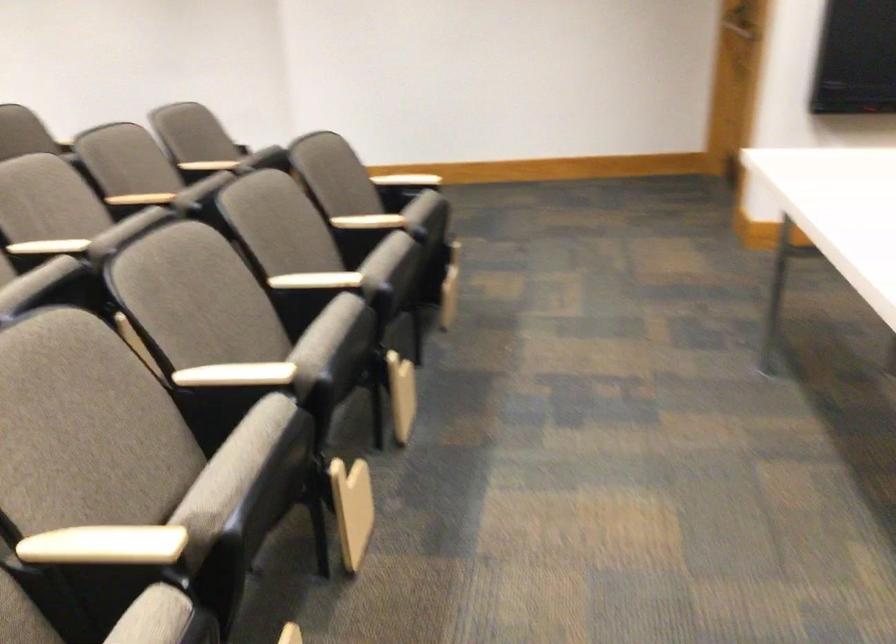
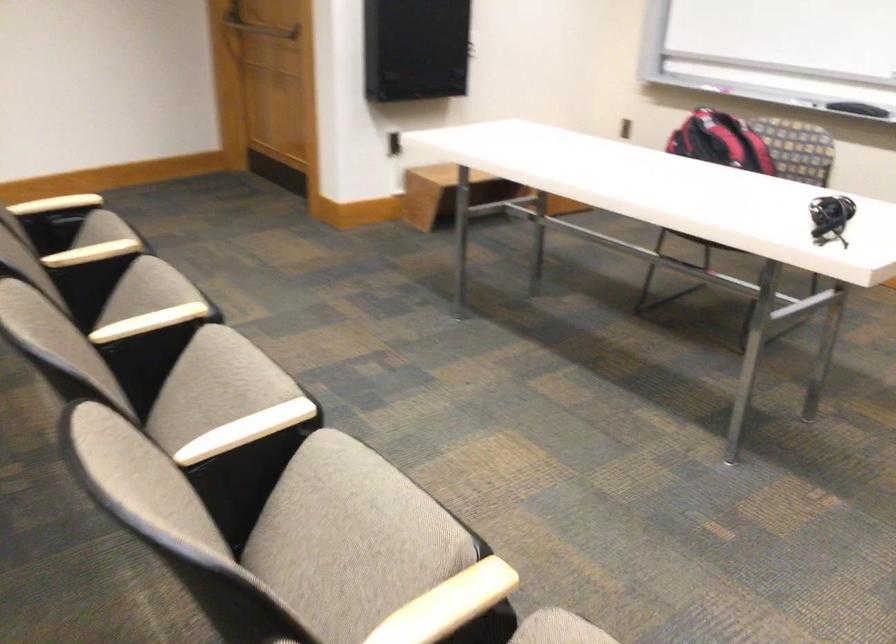
Find the pixel in the second image that matches pixel 203 477 in the first image.

(352, 531)